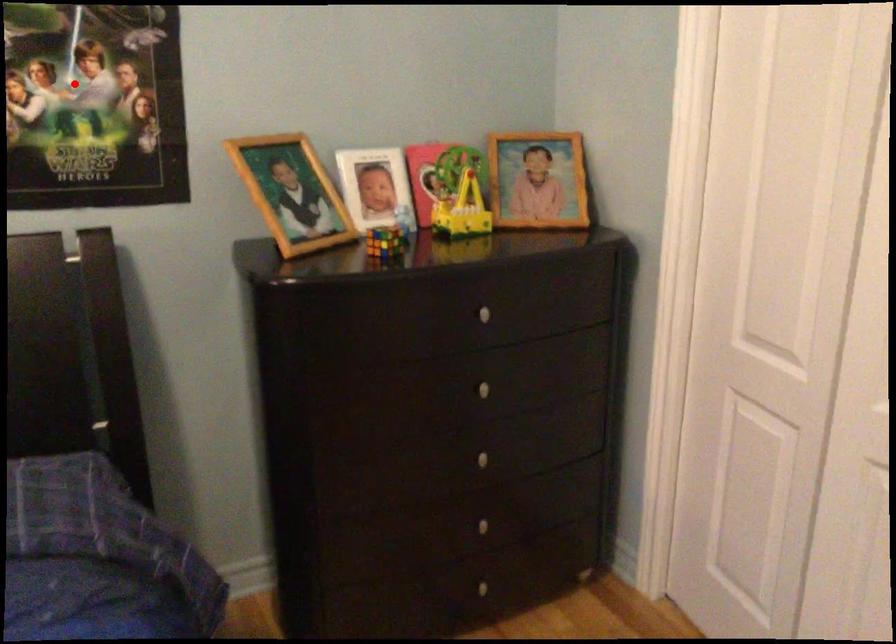
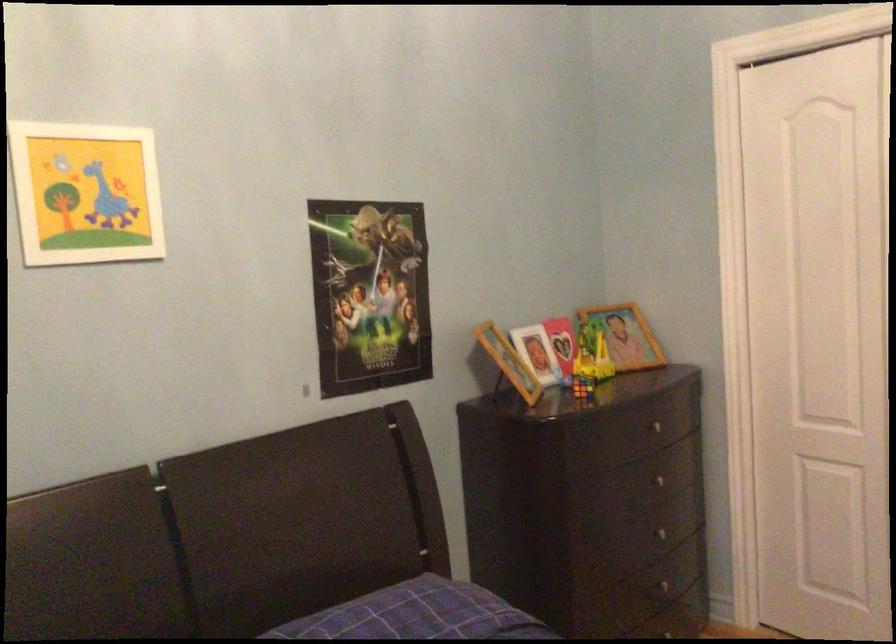
Locate, in the second image, the point that corresponds to the highlighted location in the first image.

(369, 294)